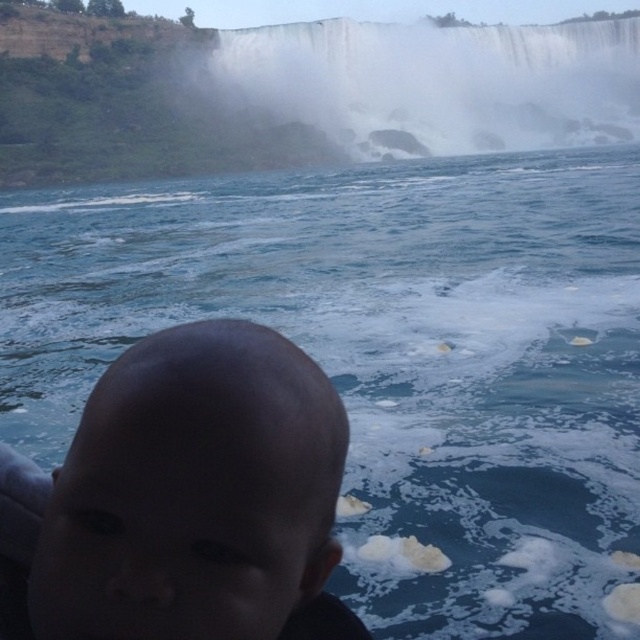
Can you confirm if dark skin head at center is positioned below white misty waterfall at upper center?

Correct, dark skin head at center is located below white misty waterfall at upper center.

In the scene shown: Measure the distance between point (102, 586) and camera.

The distance of point (102, 586) from camera is 38.30 feet.

Locate an element on the screen. dark skin head at center is located at coordinates (184, 499).